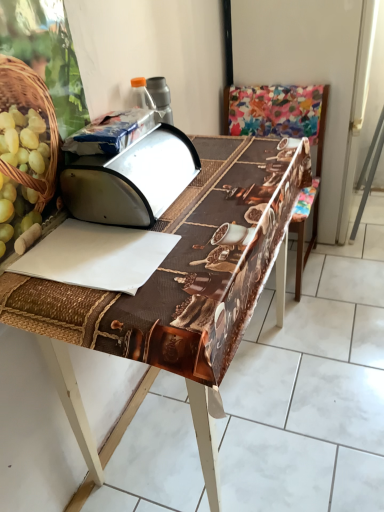
Locate an element on the screen. The height and width of the screenshot is (512, 384). space that is in front of white paper at center, the first wrapping paper in the bottom-to-top sequence is located at coordinates (105, 309).